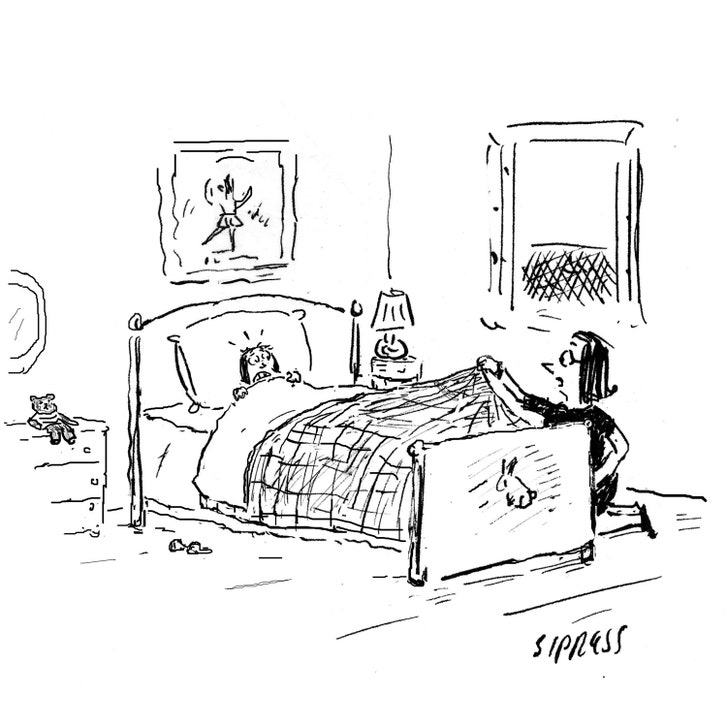
Find the location of a particular element. The width and height of the screenshot is (727, 727). hand drawn bed pillow is located at coordinates (190, 408), (166, 340), (238, 307), (300, 313), (310, 361), (182, 366).